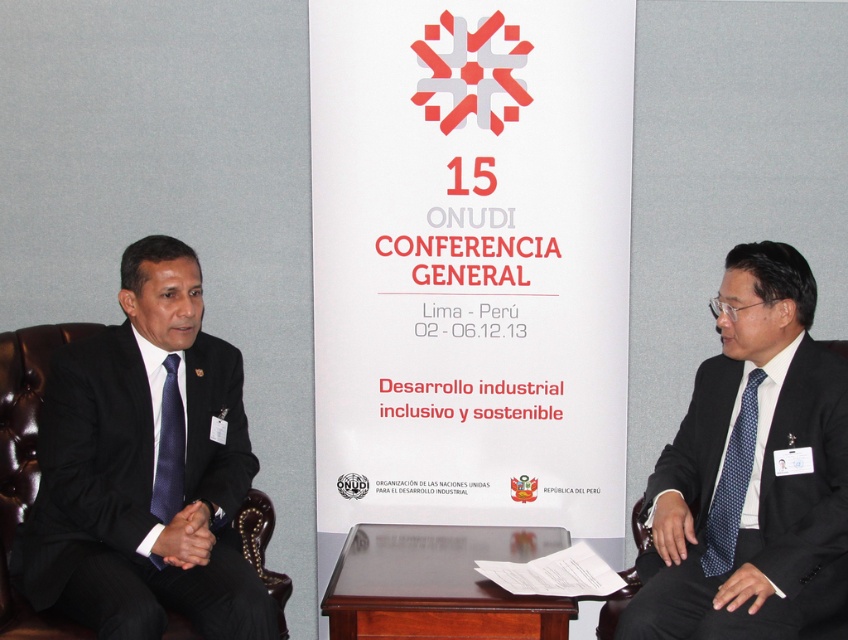
Question: Based on their relative distances, which object is nearer to the blue dotted tie at right?

Choices:
 (A) blue dotted tie at left
 (B) mahogany wood table at center
 (C) black pinstripe suit at left
 (D) dark blue textured suit at right

Answer: (D)

Question: Which point is farther to the camera?

Choices:
 (A) (486, 605)
 (B) (173, 292)
 (C) (734, 497)

Answer: (B)

Question: Can you confirm if dark blue textured suit at right is positioned above blue dotted tie at left?

Choices:
 (A) no
 (B) yes

Answer: (B)

Question: Estimate the real-world distances between objects in this image. Which object is farther from the black pinstripe suit at left?

Choices:
 (A) mahogany wood table at center
 (B) blue dotted tie at left
 (C) dark blue textured suit at right

Answer: (C)

Question: Can you confirm if dark blue textured suit at right is bigger than blue dotted tie at left?

Choices:
 (A) yes
 (B) no

Answer: (A)

Question: Does dark blue textured suit at right lie behind blue dotted tie at left?

Choices:
 (A) no
 (B) yes

Answer: (A)